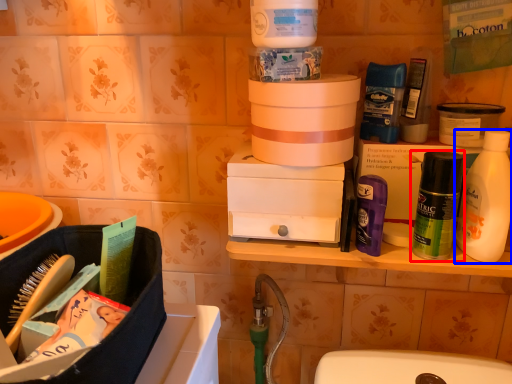
Question: Which point is further to the camera, mouthwash (highlighted by a red box) or bottle (highlighted by a blue box)?

Choices:
 (A) mouthwash
 (B) bottle

Answer: (A)